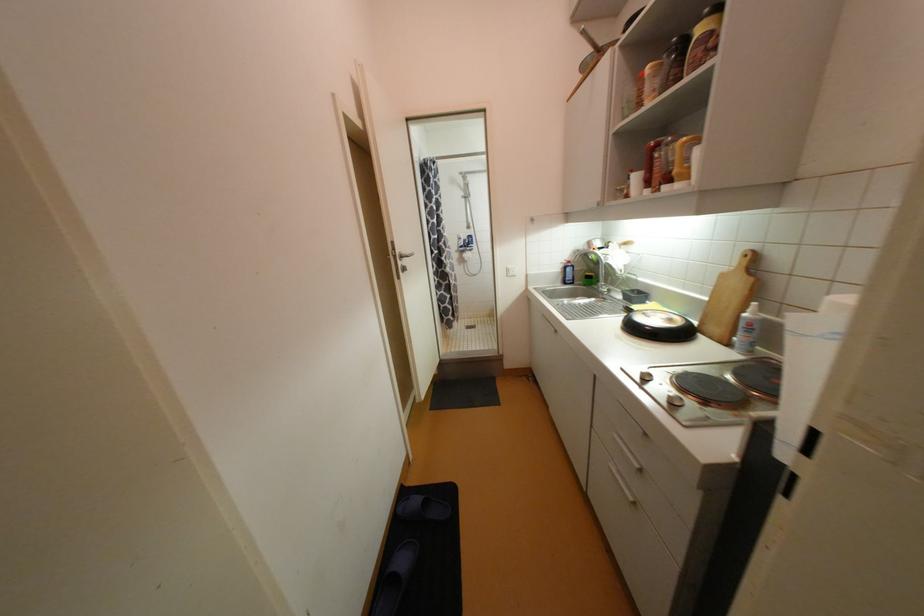
Find where to lift the blue cleaner bottle. Please return your answer as a coordinate pair (x, y).

(566, 272)